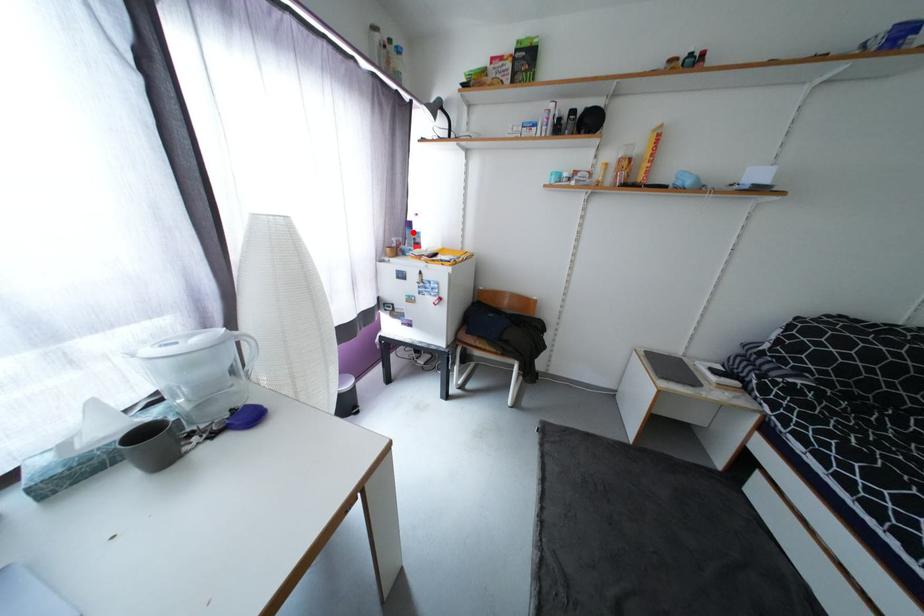
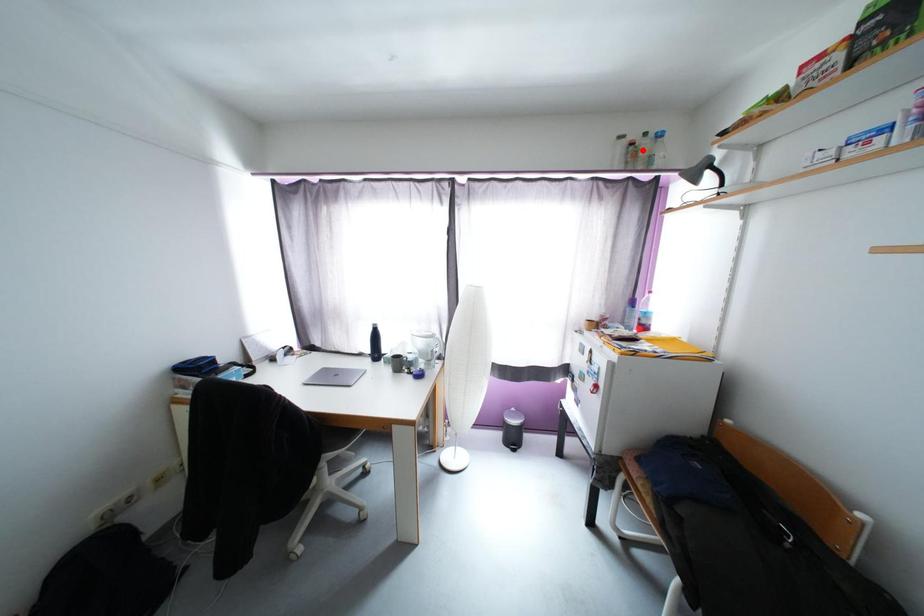
I am providing you with two images of the same scene from different viewpoints. A red point is marked on the first image and another point is marked on the second image. Do the highlighted points in image1 and image2 indicate the same real-world spot?

No